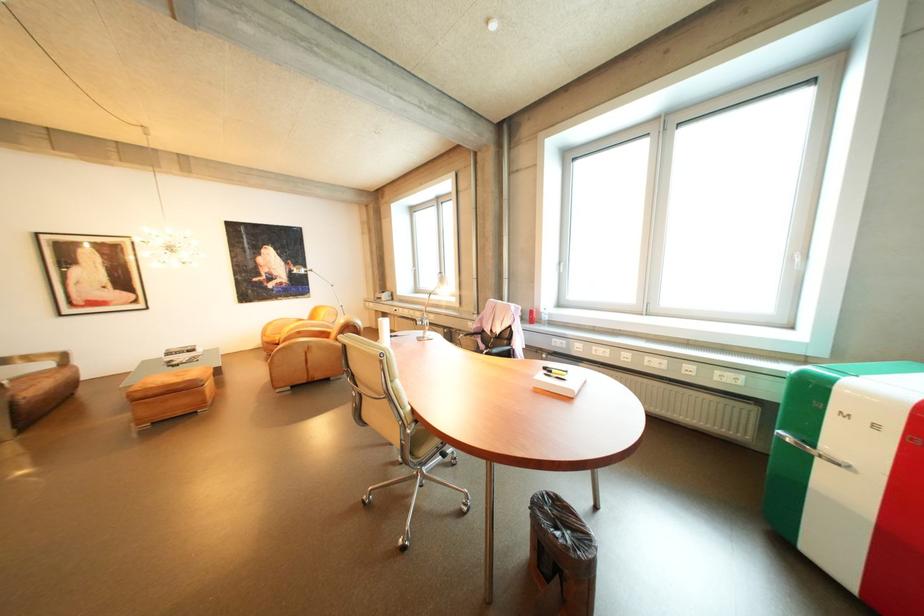
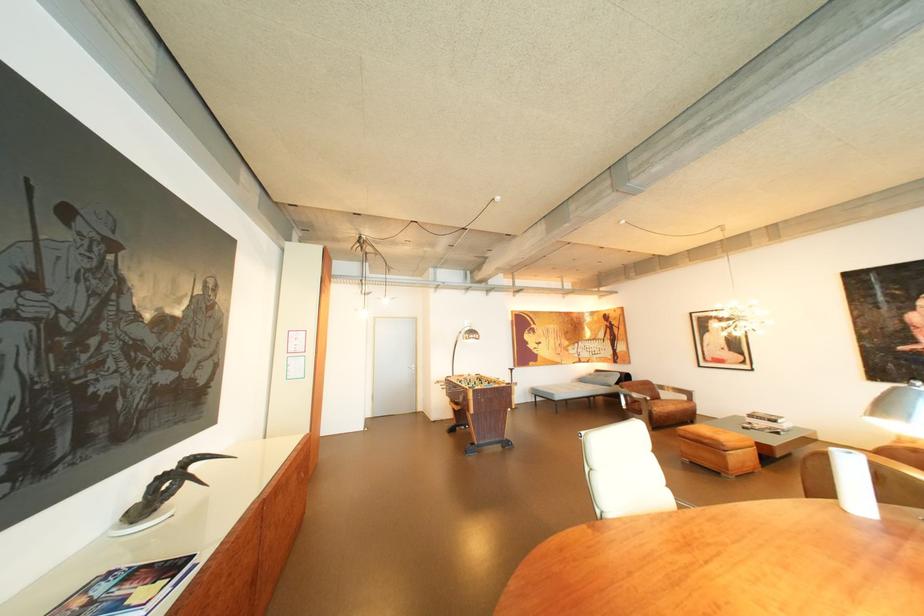
Locate, in the second image, the point that corresponds to point (181, 355) in the first image.

(763, 416)